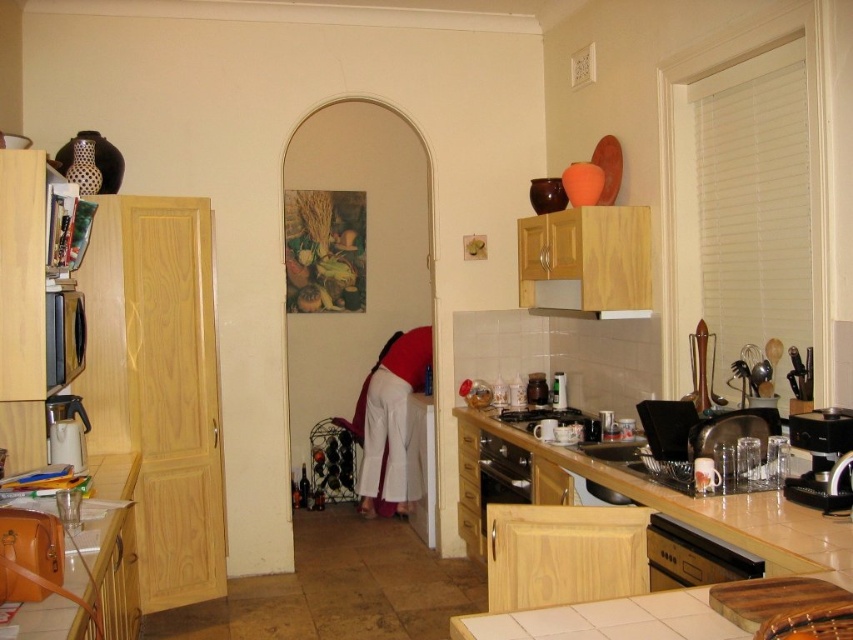
Question: Is light brown wood at center above black plastic coffee maker at right?

Choices:
 (A) no
 (B) yes

Answer: (A)

Question: Among these points, which one is farthest from the camera?

Choices:
 (A) (128, 560)
 (B) (527, 406)
 (C) (728, 545)
 (D) (822, 504)

Answer: (B)

Question: Which point is farther to the camera?

Choices:
 (A) (578, 628)
 (B) (596, 310)
 (C) (654, 538)
 (D) (786, 481)

Answer: (B)

Question: Which of the following is the closest to the observer?

Choices:
 (A) black stainless steel dishwasher at lower right
 (B) wooden exhaust hood at upper center
 (C) matte black stove at center

Answer: (A)

Question: Can you confirm if brown leather bag at lower left is positioned to the left of black stainless steel dishwasher at lower right?

Choices:
 (A) no
 (B) yes

Answer: (B)

Question: Can you confirm if black stainless steel dishwasher at lower right is smaller than black plastic coffee maker at right?

Choices:
 (A) yes
 (B) no

Answer: (B)